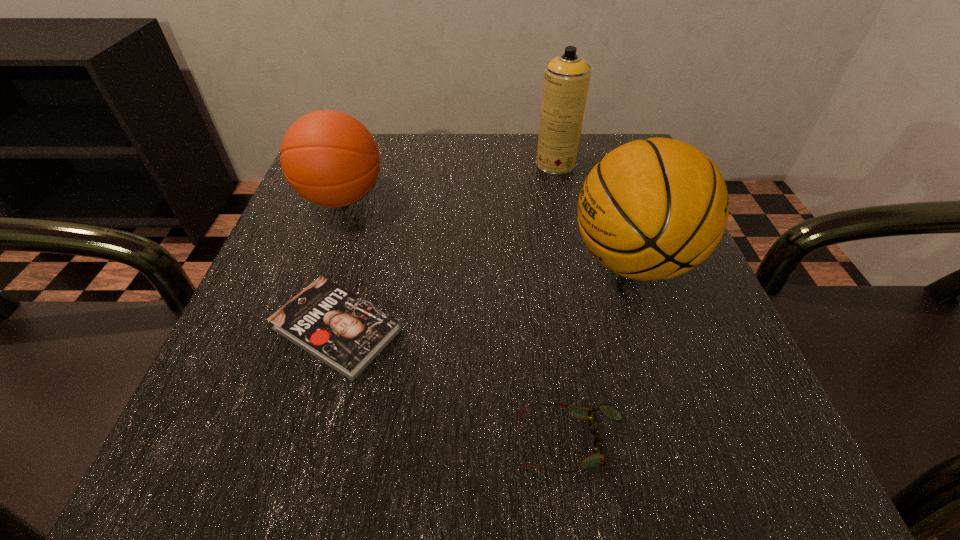
The image size is (960, 540). I want to click on blank space located 0.130m on the surface of the right basketball near the brand logo, so click(494, 261).

Locate an element on the screen. This screenshot has width=960, height=540. free spot located on the right of the left basketball is located at coordinates (445, 198).

You are a GUI agent. You are given a task and a screenshot of the screen. Output one action in this format:
    pyautogui.click(x=<x>, y=<y>)
    Task: Click on the free point located 0.250m on the front-facing side of the fourth tallest object
    The width and height of the screenshot is (960, 540).
    Given the screenshot: What is the action you would take?
    pyautogui.click(x=317, y=442)

Locate an element on the screen. Image resolution: width=960 pixels, height=540 pixels. vacant space positioned 0.110m on the front-facing side of the fourth tallest object is located at coordinates (430, 442).

Where is `free spot located 0.310m on the front-facing side of the fourth tallest object`? The image size is (960, 540). free spot located 0.310m on the front-facing side of the fourth tallest object is located at coordinates (268, 442).

Find the location of `free point located 0.210m on the back of the shortest object`. free point located 0.210m on the back of the shortest object is located at coordinates (372, 208).

What are the coordinates of `aerosol can positioned at the far edge` in the screenshot? It's located at (566, 80).

The image size is (960, 540). I want to click on basketball at the far edge, so pyautogui.click(x=329, y=158).

Locate an element on the screen. Image resolution: width=960 pixels, height=540 pixels. object located at the near edge is located at coordinates (598, 459).

At what (x,y) coordinates should I click in order to perform the action: click on basketball that is at the left edge. Please return your answer as a coordinate pair (x, y). The height and width of the screenshot is (540, 960). Looking at the image, I should click on (329, 158).